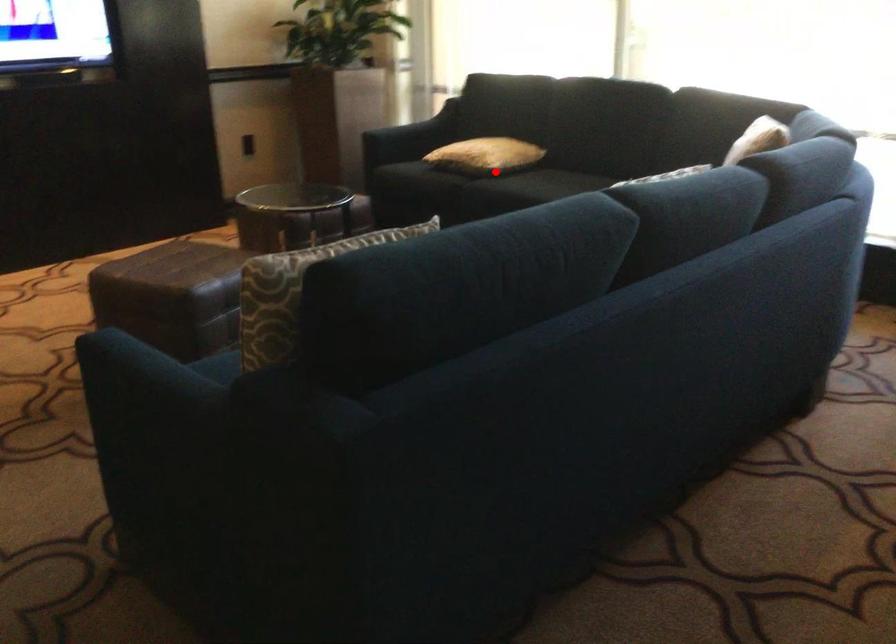
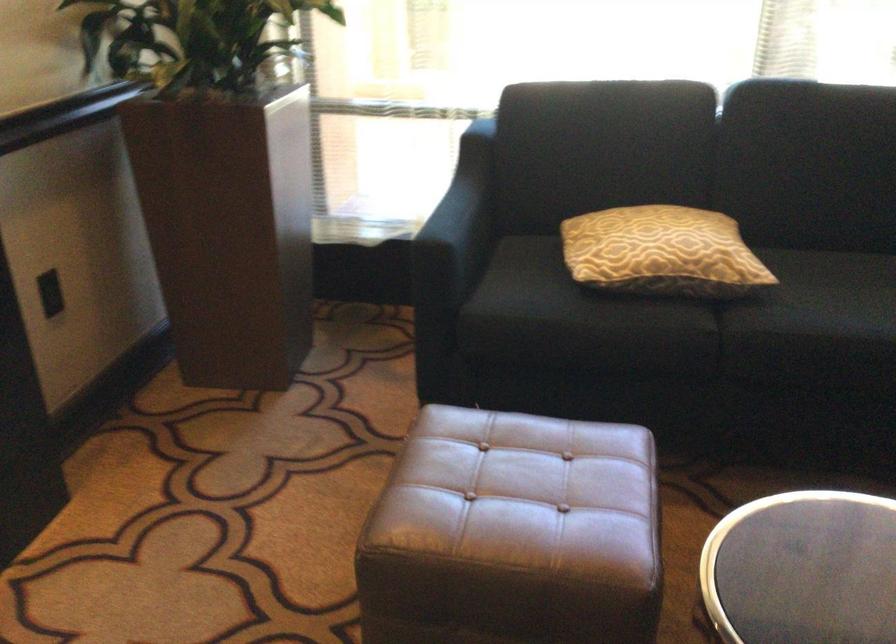
Question: I am providing you with two images of the same scene from different viewpoints. In image1, a red point is highlighted. Considering the same 3D point in image2, which of the following is correct?

Choices:
 (A) It is closer
 (B) It is farther

Answer: (A)